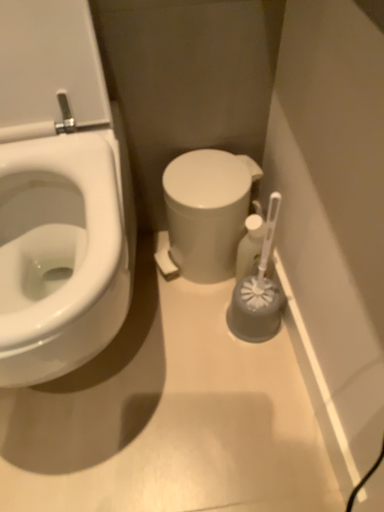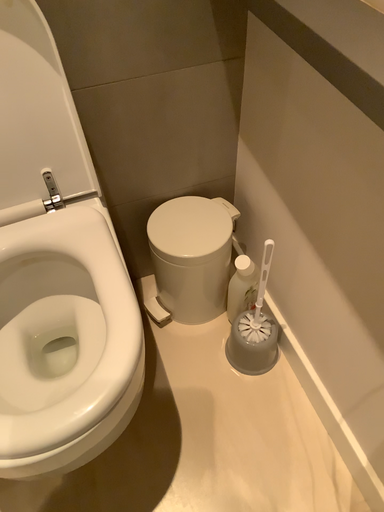
Question: Which way did the camera rotate in the video?

Choices:
 (A) rotated left
 (B) rotated right

Answer: (B)